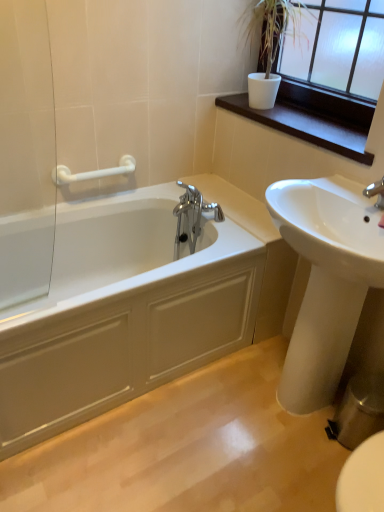
Where is `free space below white plastic grab bar at upper left (from a real-world perspective)`? The height and width of the screenshot is (512, 384). free space below white plastic grab bar at upper left (from a real-world perspective) is located at coordinates pos(99,198).